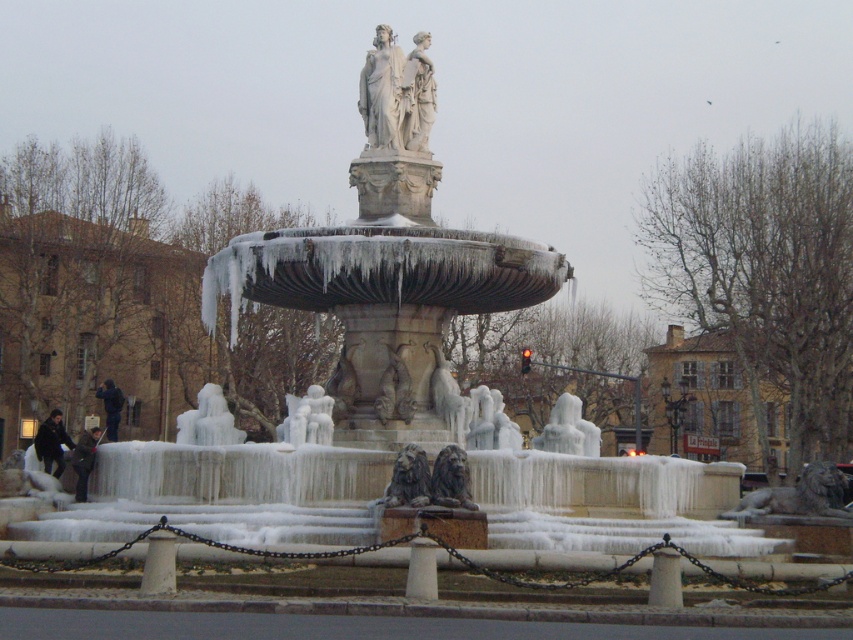
Does white marble statues at center appear over dark brown stone lion at center?

Yes, white marble statues at center is above dark brown stone lion at center.

Locate an element on the screen. Image resolution: width=853 pixels, height=640 pixels. white marble statues at center is located at coordinates (381, 92).

Locate an element on the screen. white marble statues at center is located at coordinates (381, 92).

Is dark brown stone lion at center bigger than carved stone lion at center?

Yes, dark brown stone lion at center is bigger than carved stone lion at center.

Is dark brown stone lion at center above carved stone lion at center?

A: No.

Which is in front, point (386, 506) or point (393, 388)?

Point (386, 506) is more forward.

Where is `dark brown stone lion at center`? This screenshot has width=853, height=640. dark brown stone lion at center is located at coordinates (409, 480).

Which of these two, white marble statues at center or carved stone lion at center, stands taller?

Standing taller between the two is white marble statues at center.

Is white marble statues at center bigger than carved stone lion at center?

Indeed, white marble statues at center has a larger size compared to carved stone lion at center.

You are a GUI agent. You are given a task and a screenshot of the screen. Output one action in this format:
    pyautogui.click(x=<x>, y=<y>)
    Task: Click on the white marble statues at center
    This screenshot has width=853, height=640.
    Given the screenshot: What is the action you would take?
    pyautogui.click(x=381, y=92)